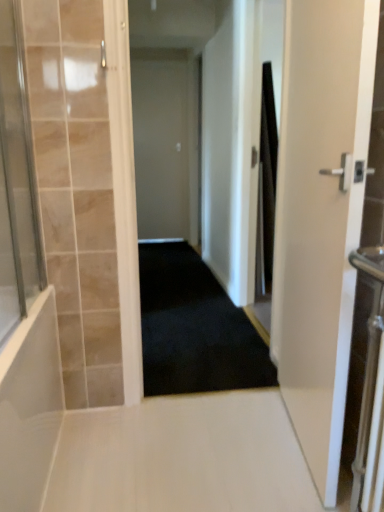
Question: Is white matte door at center, which ranks as the 2th door in right-to-left order, at the left side of black carpet at center?

Choices:
 (A) no
 (B) yes

Answer: (B)

Question: Is white matte door at center, which appears as the 2th door when viewed from the front, not inside black carpet at center?

Choices:
 (A) yes
 (B) no

Answer: (A)

Question: Can you confirm if white matte door at center, which ranks as the 1th door in back-to-front order, is taller than black carpet at center?

Choices:
 (A) no
 (B) yes

Answer: (B)

Question: Is black carpet at center a part of white matte door at center, which ranks as the 1th door in back-to-front order?

Choices:
 (A) yes
 (B) no

Answer: (B)

Question: From the image's perspective, would you say white matte door at center, placed as the 1th door when sorted from left to right, is positioned over black carpet at center?

Choices:
 (A) no
 (B) yes

Answer: (B)

Question: From a real-world perspective, is black carpet at center physically located above or below white glossy door at right, the 1th door positioned from the front?

Choices:
 (A) below
 (B) above

Answer: (A)

Question: Considering the positions of point (183, 260) and point (281, 259), is point (183, 260) closer or farther from the camera than point (281, 259)?

Choices:
 (A) closer
 (B) farther

Answer: (B)

Question: In terms of width, does black carpet at center look wider or thinner when compared to white glossy door at right, acting as the 2th door starting from the back?

Choices:
 (A) thin
 (B) wide

Answer: (B)

Question: Is black carpet at center taller or shorter than white glossy door at right, the 2th door positioned from the left?

Choices:
 (A) short
 (B) tall

Answer: (A)

Question: Is black carpet at center taller or shorter than white matte door at center, which ranks as the 1th door in back-to-front order?

Choices:
 (A) short
 (B) tall

Answer: (A)

Question: Relative to white matte door at center, placed as the 1th door when sorted from left to right, is black carpet at center in front or behind?

Choices:
 (A) behind
 (B) front

Answer: (B)

Question: From the image's perspective, is black carpet at center above or below white matte door at center, which ranks as the 2th door in right-to-left order?

Choices:
 (A) below
 (B) above

Answer: (A)

Question: Would you say black carpet at center is to the left or to the right of white matte door at center, which ranks as the 1th door in back-to-front order, in the picture?

Choices:
 (A) left
 (B) right

Answer: (B)

Question: From their relative heights in the image, would you say white glossy floor at center is taller or shorter than black fabric shower curtain at right?

Choices:
 (A) tall
 (B) short

Answer: (B)

Question: Which is correct: white glossy floor at center is inside black fabric shower curtain at right, or outside of it?

Choices:
 (A) inside
 (B) outside

Answer: (B)